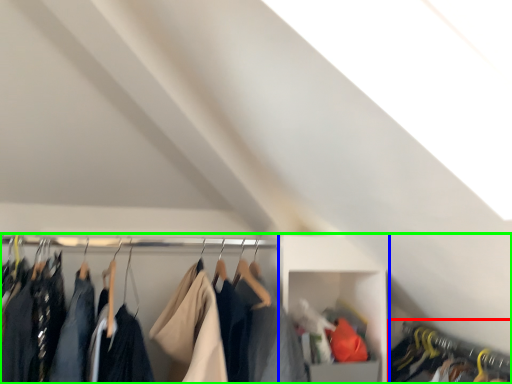
Question: Which object is positioned farthest from closet (highlighted by a red box)? Select from cabinet (highlighted by a blue box) and closet (highlighted by a green box).

Choices:
 (A) cabinet
 (B) closet

Answer: (B)